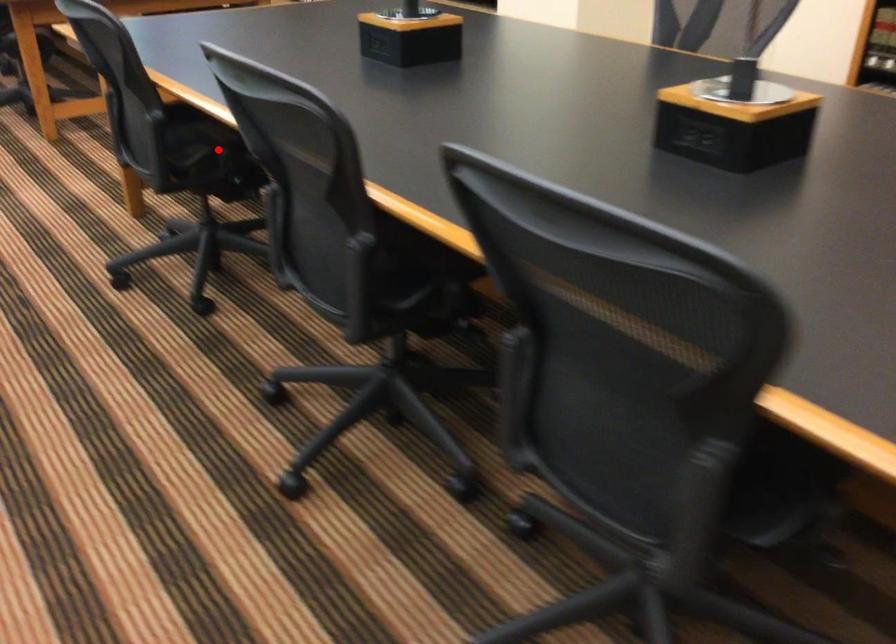
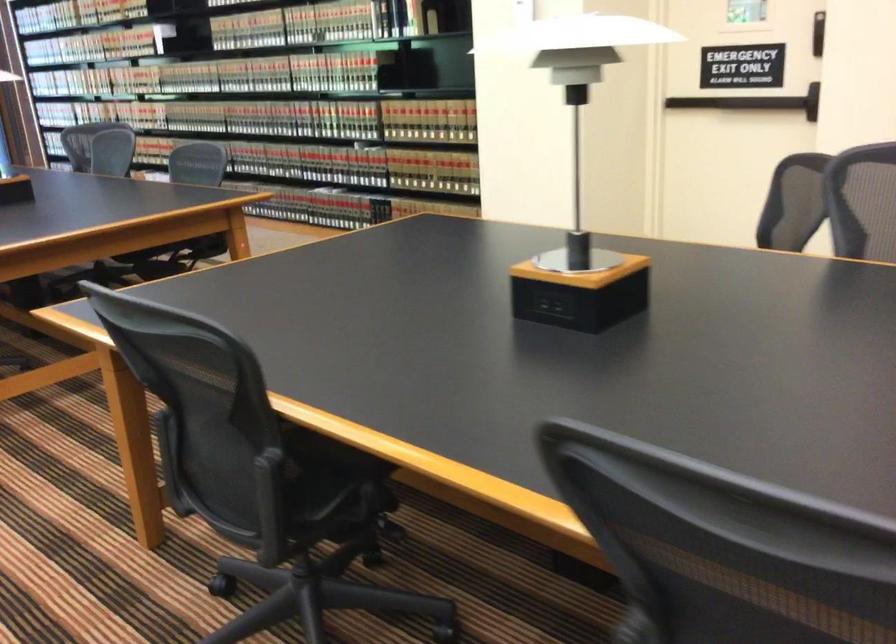
The point at the highlighted location is marked in the first image. Where is the corresponding point in the second image?

(336, 482)